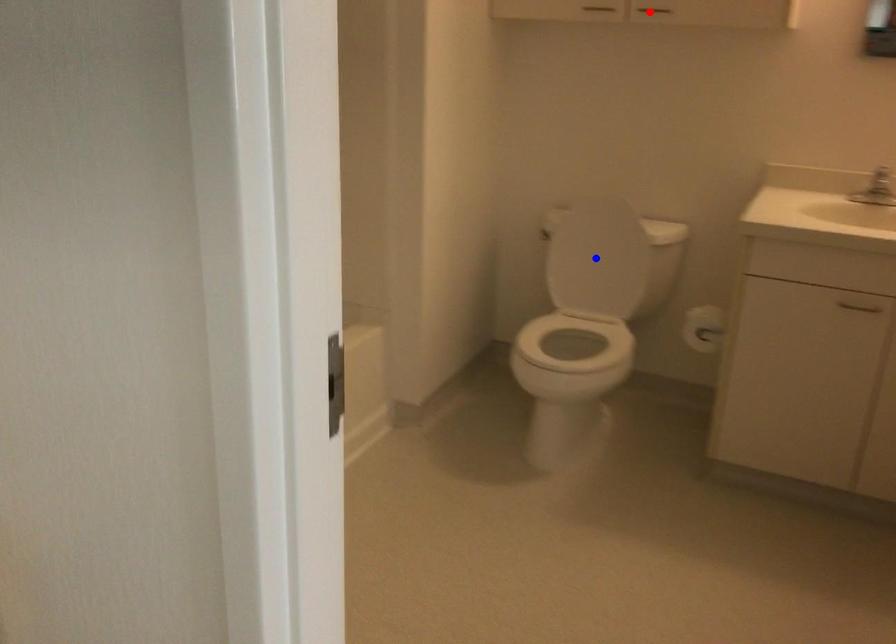
Question: Which of the two points in the image is closer to the camera?

Choices:
 (A) Blue point is closer.
 (B) Red point is closer.

Answer: (B)